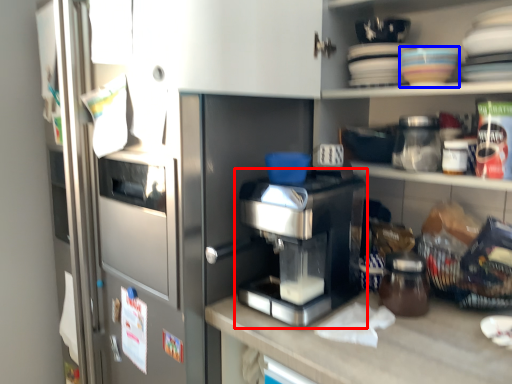
Question: Which object appears farthest to the camera in this image, home appliance (highlighted by a red box) or tableware (highlighted by a blue box)?

Choices:
 (A) home appliance
 (B) tableware

Answer: (B)